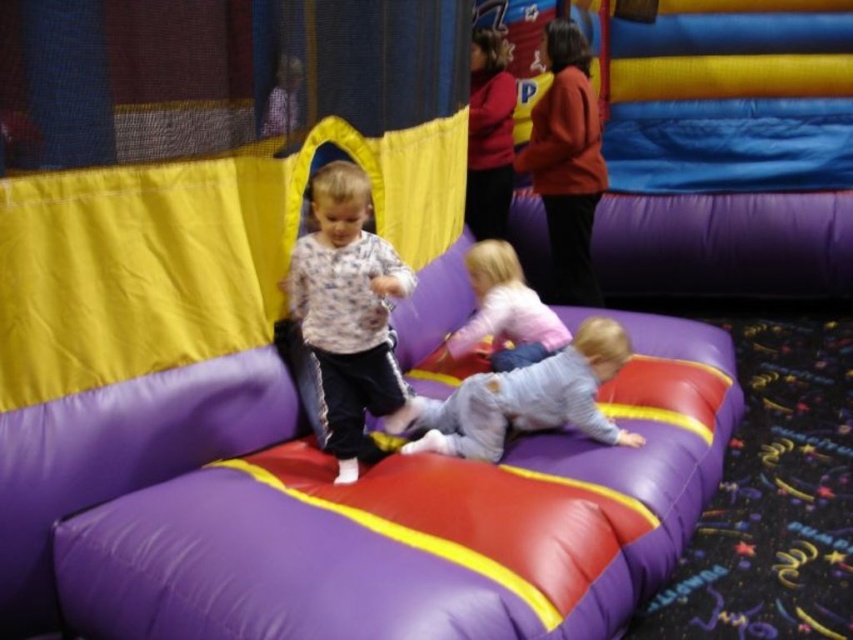
Is fluffy white sweater at center taller than gray fabric boy at lower center?

Yes, fluffy white sweater at center is taller than gray fabric boy at lower center.

Is fluffy white sweater at center positioned before gray fabric boy at lower center?

Yes, fluffy white sweater at center is closer to the viewer.

Is point (344, 225) positioned in front of point (599, 326)?

Yes, it is in front of point (599, 326).

Where is `fluffy white sweater at center`? The height and width of the screenshot is (640, 853). fluffy white sweater at center is located at coordinates (347, 312).

Which of these two, fluffy white sweater at center or light pink fabric toddler at center, stands taller?

fluffy white sweater at center

Consider the image. Between fluffy white sweater at center and light pink fabric toddler at center, which one is positioned higher?

Positioned higher is light pink fabric toddler at center.

This screenshot has height=640, width=853. In order to click on fluffy white sweater at center in this screenshot , I will do `click(347, 312)`.

Measure the distance between gray fabric boy at lower center and light pink fabric toddler at center.

They are 20.72 inches apart.

Measure the distance between gray fabric boy at lower center and light pink fabric toddler at center.

They are 20.72 inches apart.

Does point (550, 380) come farther from viewer compared to point (491, 241)?

No, (550, 380) is in front of (491, 241).

Locate an element on the screen. The width and height of the screenshot is (853, 640). gray fabric boy at lower center is located at coordinates (529, 397).